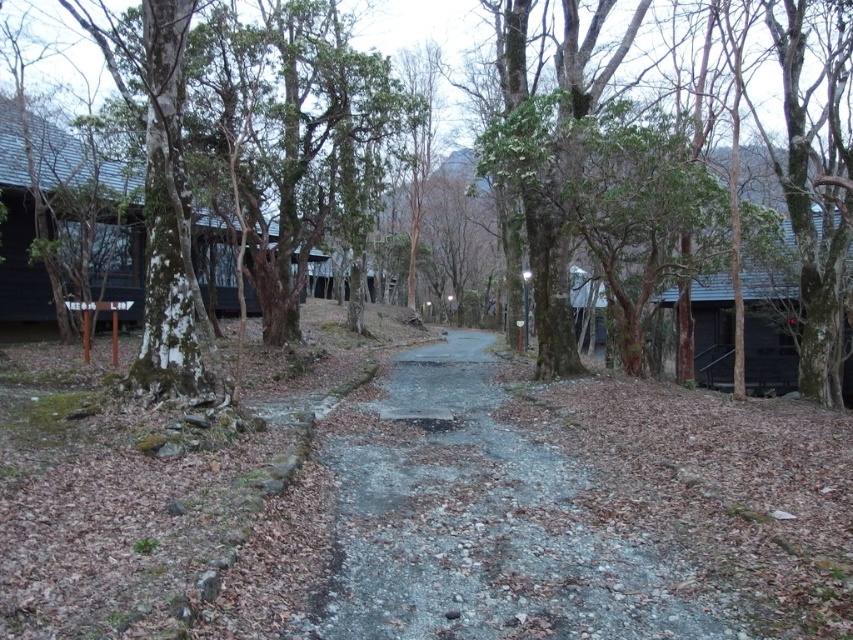
Question: Which object is positioned farthest from the green rough bark tree at center?

Choices:
 (A) matte black cabin at left
 (B) gray gravel path at center

Answer: (A)

Question: Can you confirm if gray gravel path at center is thinner than green rough bark tree at center?

Choices:
 (A) no
 (B) yes

Answer: (B)

Question: Is gray gravel path at center to the right of green rough bark tree at center from the viewer's perspective?

Choices:
 (A) no
 (B) yes

Answer: (A)

Question: Is gray gravel path at center positioned in front of matte black cabin at left?

Choices:
 (A) yes
 (B) no

Answer: (A)

Question: Which of the following is the farthest from the observer?

Choices:
 (A) (637, 42)
 (B) (19, 212)
 (C) (659, 600)

Answer: (A)

Question: Which point is closer to the camera taking this photo?

Choices:
 (A) (462, 625)
 (B) (93, 198)

Answer: (A)